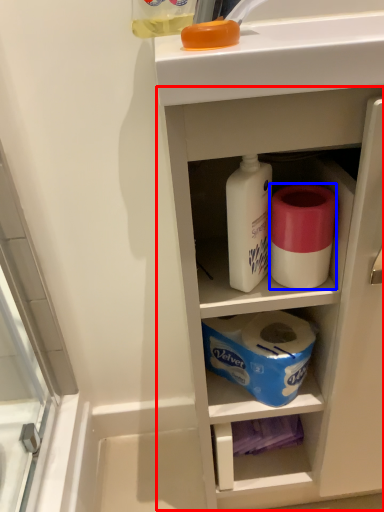
Question: Which point is closer to the camera, cabinetry (highlighted by a red box) or toilet paper (highlighted by a blue box)?

Choices:
 (A) cabinetry
 (B) toilet paper

Answer: (A)